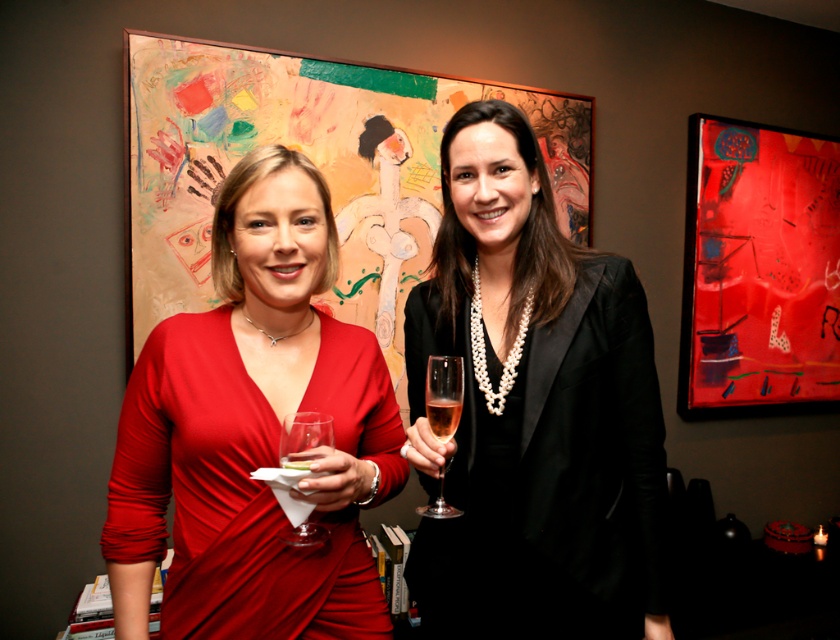
Question: Can you confirm if matte red dress at center is positioned to the right of pink crystal wine glass at center?

Choices:
 (A) no
 (B) yes

Answer: (A)

Question: Which point is farther to the camera?

Choices:
 (A) translucent glass at center
 (B) clear glass wine glass at lower left

Answer: (A)

Question: Is black satin dress at center above matte red dress at center?

Choices:
 (A) yes
 (B) no

Answer: (A)

Question: Is black satin dress at center smaller than pink crystal wine glass at center?

Choices:
 (A) no
 (B) yes

Answer: (A)

Question: Which point is farther from the camera taking this photo?

Choices:
 (A) (239, 474)
 (B) (445, 403)

Answer: (A)

Question: Estimate the real-world distances between objects in this image. Which object is farther from the matte red dress at center?

Choices:
 (A) black satin dress at center
 (B) pink crystal wine glass at center

Answer: (A)